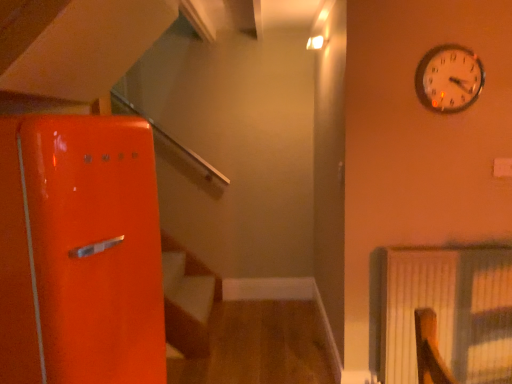
Question: Is white textured radiator at right wider or thinner than metallic silver clock at upper right?

Choices:
 (A) thin
 (B) wide

Answer: (B)

Question: In terms of height, does white textured radiator at right look taller or shorter compared to metallic silver clock at upper right?

Choices:
 (A) short
 (B) tall

Answer: (B)

Question: Based on their positions, is white textured radiator at right located to the left or right of metallic silver clock at upper right?

Choices:
 (A) right
 (B) left

Answer: (A)

Question: Is metallic silver clock at upper right to the left or to the right of white textured radiator at right in the image?

Choices:
 (A) left
 (B) right

Answer: (A)

Question: From the image's perspective, is metallic silver clock at upper right above or below white textured radiator at right?

Choices:
 (A) above
 (B) below

Answer: (A)

Question: In terms of width, does metallic silver clock at upper right look wider or thinner when compared to white textured radiator at right?

Choices:
 (A) wide
 (B) thin

Answer: (B)

Question: From their relative heights in the image, would you say metallic silver clock at upper right is taller or shorter than white textured radiator at right?

Choices:
 (A) tall
 (B) short

Answer: (B)